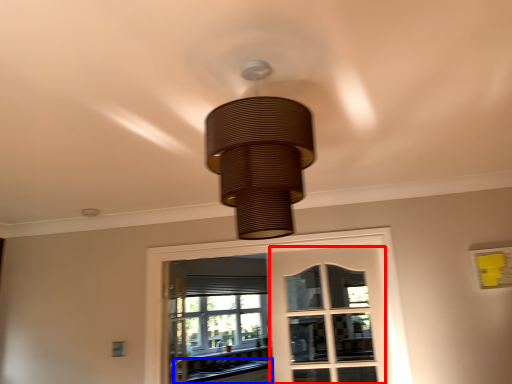
Question: Which object appears closest to the camera in this image, screen door (highlighted by a red box) or counter top (highlighted by a blue box)?

Choices:
 (A) screen door
 (B) counter top

Answer: (A)